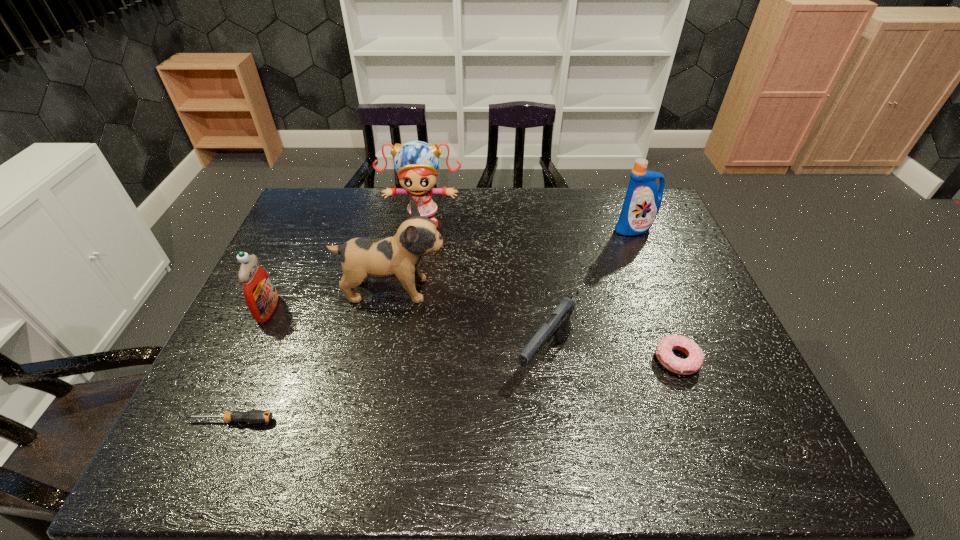
Locate an element on the screen. doll is located at coordinates (417, 163).

This screenshot has height=540, width=960. In order to click on puppy in this screenshot , I will do `click(398, 256)`.

Find the location of a particular element. This screenshot has width=960, height=540. the farther detergent is located at coordinates (642, 202).

This screenshot has height=540, width=960. Identify the location of the taller detergent. (642, 202).

Identify the location of the nearer detergent. This screenshot has width=960, height=540. (261, 297).

Find the location of a particular element. Image resolution: width=960 pixels, height=540 pixels. the shorter detergent is located at coordinates (261, 297).

Locate an element on the screen. This screenshot has width=960, height=540. the third shortest object is located at coordinates (558, 325).

Where is `gun`? The width and height of the screenshot is (960, 540). gun is located at coordinates (558, 325).

Image resolution: width=960 pixels, height=540 pixels. In order to click on the second shortest object in this screenshot , I will do `click(695, 357)`.

Find the location of a particular element. This screenshot has height=540, width=960. the nearest object is located at coordinates (253, 416).